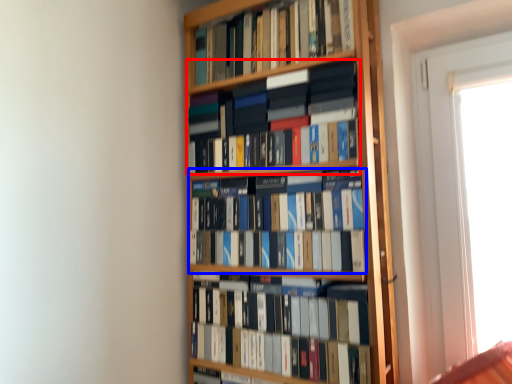
Question: Which object appears closest to the camera in this image, book (highlighted by a red box) or book (highlighted by a blue box)?

Choices:
 (A) book
 (B) book

Answer: (B)